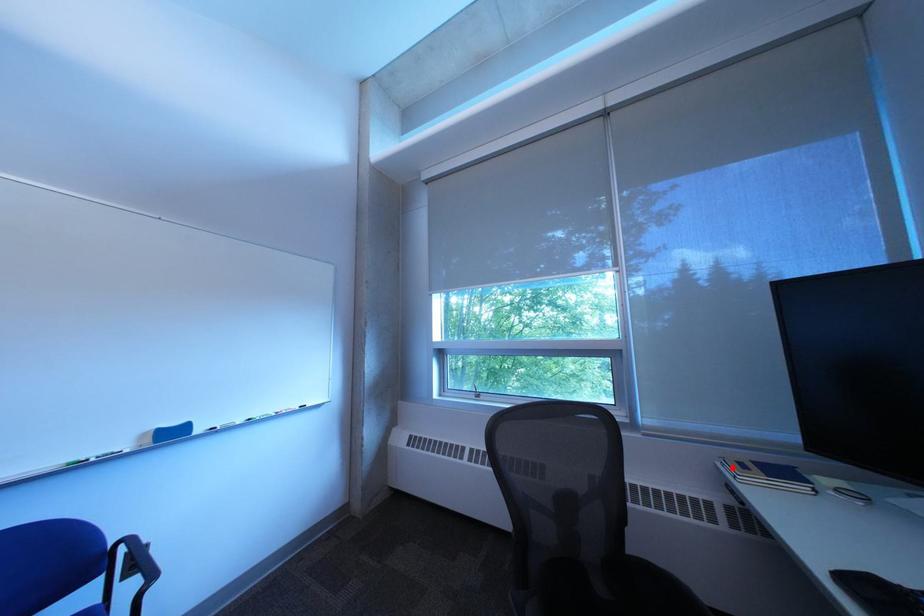
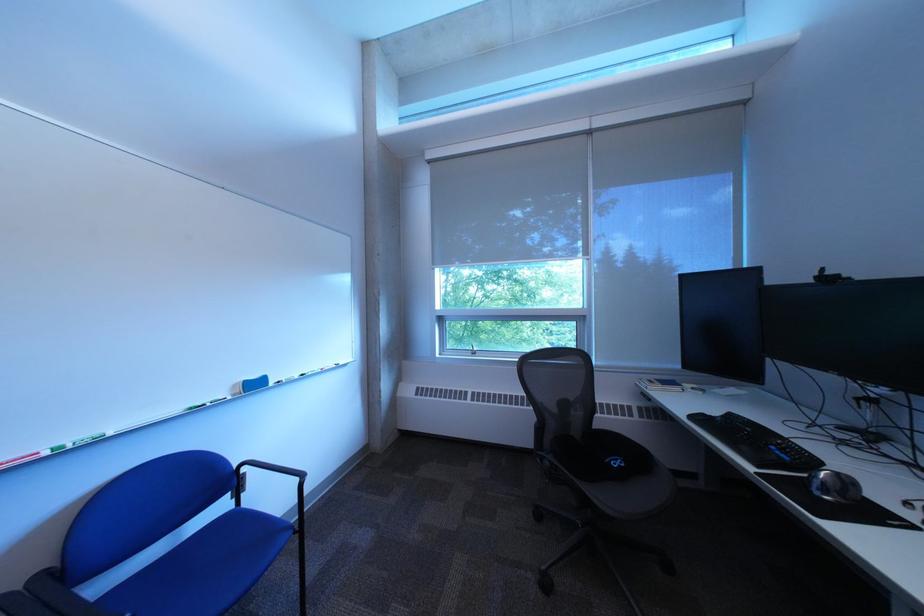
Find the pixel in the second image that matches the highlighted location in the first image.

(651, 386)